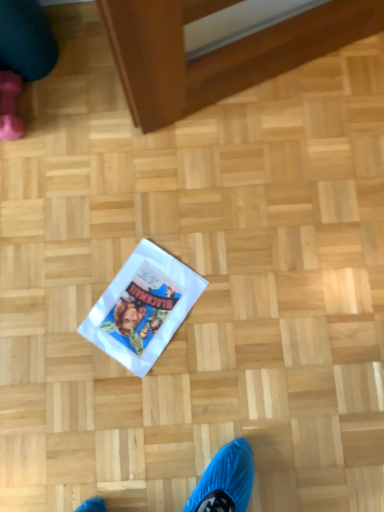
This screenshot has width=384, height=512. I want to click on free space above white paper flyer at center (from a real-world perspective), so click(147, 305).